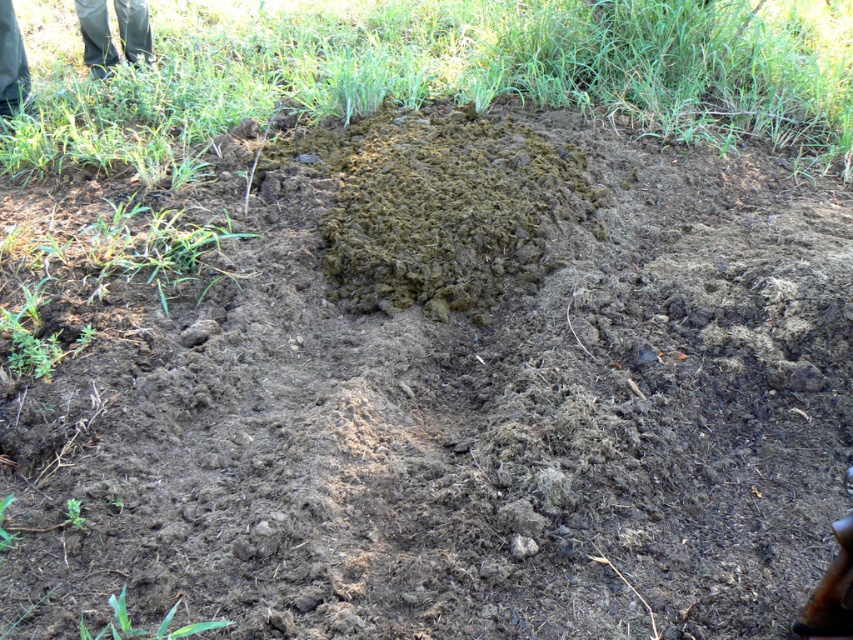
Question: Which point is farther to the camera?

Choices:
 (A) (344, 227)
 (B) (96, 1)

Answer: (B)

Question: Which point is farther to the camera?

Choices:
 (A) (96, 10)
 (B) (357, 134)

Answer: (A)

Question: From the image, what is the correct spatial relationship of brown soil mound at center in relation to green rubber boots at upper left?

Choices:
 (A) left
 (B) right

Answer: (B)

Question: Is brown soil mound at center to the right of green rubber boots at upper left from the viewer's perspective?

Choices:
 (A) yes
 (B) no

Answer: (A)

Question: Which point appears closest to the camera in this image?

Choices:
 (A) (82, 10)
 (B) (579, 180)

Answer: (B)

Question: Is brown soil mound at center to the right of green rubber boots at upper left from the viewer's perspective?

Choices:
 (A) yes
 (B) no

Answer: (A)